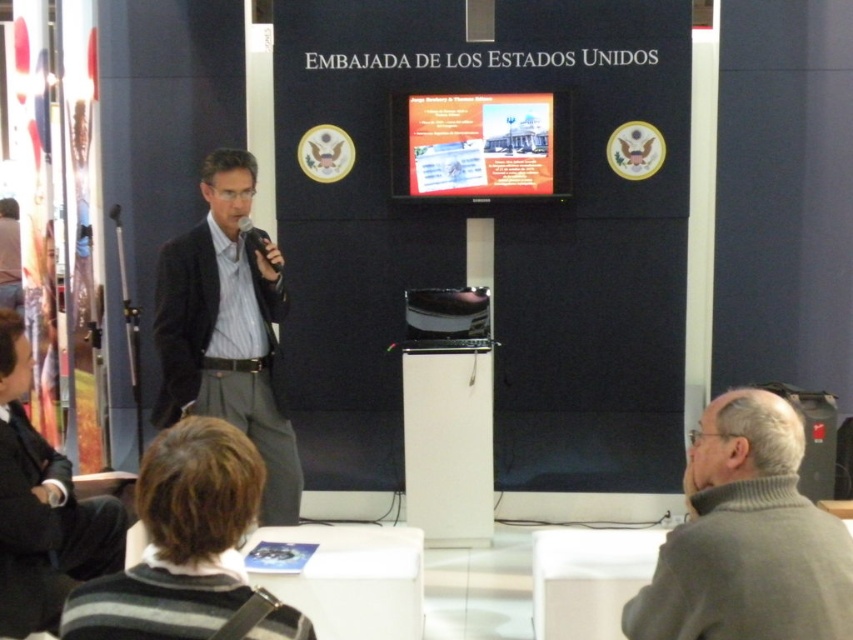
You are an event organizer at the embassy and need to decide whether the matte black suit at center can be placed inside a display case designed to hold items no larger than the black plastic microphone at center. Based on the description, what is your conclusion?

The matte black suit at center has a larger size compared to the black plastic microphone at center, so it cannot be placed inside the display case designed for items no larger than the microphone.

You are an event organizer at the embassy and need to ensure the microphone is visible to the audience. Based on the image, is the black plastic microphone at center likely to be obscured by the matte black suit at center?

The matte black suit at center might be wider than black plastic microphone at center, so there is a possibility that the microphone could be partially obscured if the presenter moves or shifts position, but currently, the microphone is visible as described.

In the scene shown: You are an event organizer at the embassy and need to arrange seating for two guests wearing the matte black suit at center and the black fabric business suit at lower left. Based on their positions in the image, which guest should be seated closer to the front of the room?

The matte black suit at center is located above the black fabric business suit at lower left, so the guest wearing the matte black suit at center should be seated closer to the front since they are positioned higher in the image, indicating a more prominent role.